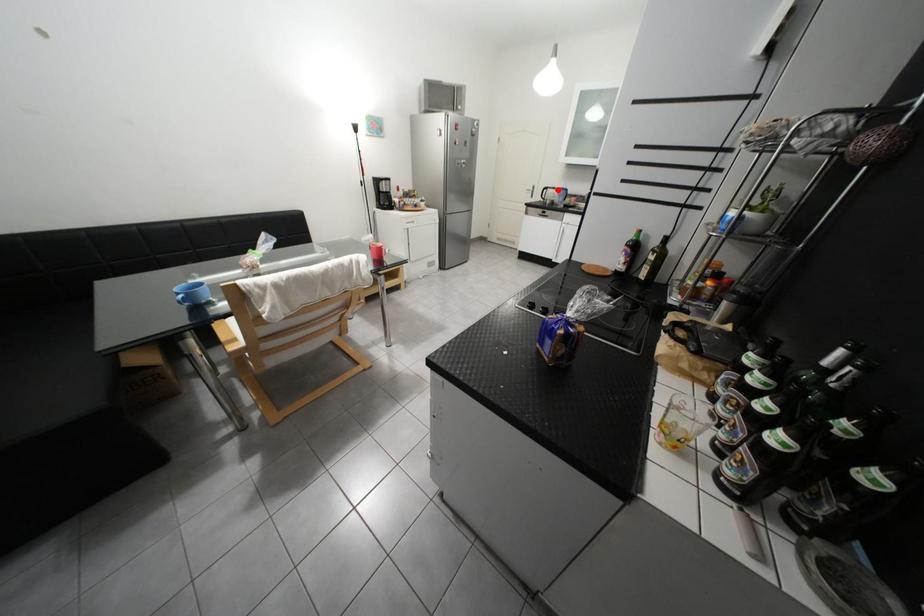
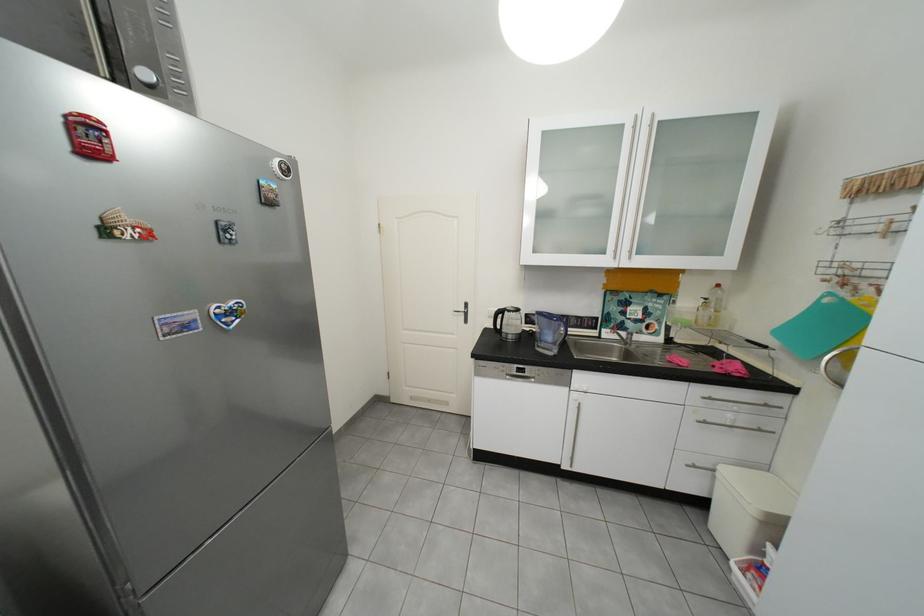
Question: I am providing you with two images of the same scene from different viewpoints. Image1 has a red point marked. In image2, the corresponding 3D location appears at what relative position? Reply with the corresponding letter.

Choices:
 (A) Closer
 (B) Farther

Answer: (B)